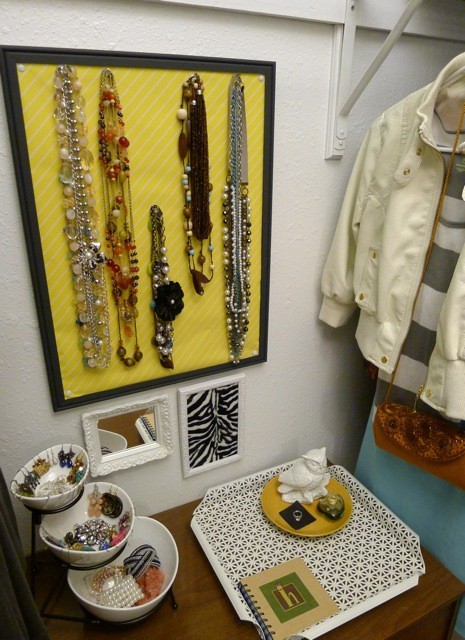
Where is `bowl`? Image resolution: width=465 pixels, height=640 pixels. bowl is located at coordinates (59, 472), (118, 512), (165, 534).